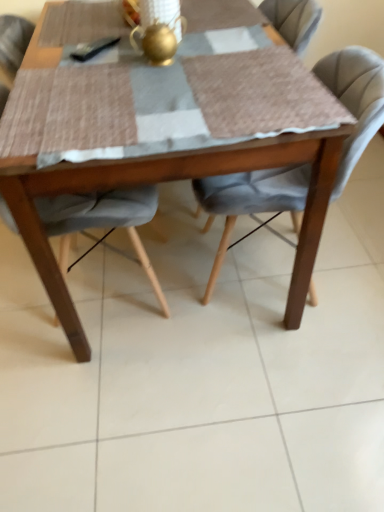
Question: From the image's perspective, is gold metallic teapot at center located above or below velvet grey chair at center, positioned as the first chair in right-to-left order?

Choices:
 (A) below
 (B) above

Answer: (B)

Question: From a real-world perspective, is gold metallic teapot at center above or below velvet grey chair at center, positioned as the first chair in right-to-left order?

Choices:
 (A) below
 (B) above

Answer: (B)

Question: Which object is positioned closest to the gold metallic teapot at center?

Choices:
 (A) wooden table at center
 (B) velvet grey chair at center, positioned as the second chair in left-to-right order
 (C) velvet grey chair at center, marked as the first chair in a left-to-right arrangement

Answer: (A)

Question: Estimate the real-world distances between objects in this image. Which object is farther from the velvet grey chair at center, which ranks as the second chair in right-to-left order?

Choices:
 (A) gold metallic teapot at center
 (B) wooden table at center
 (C) velvet grey chair at center, positioned as the first chair in right-to-left order

Answer: (A)